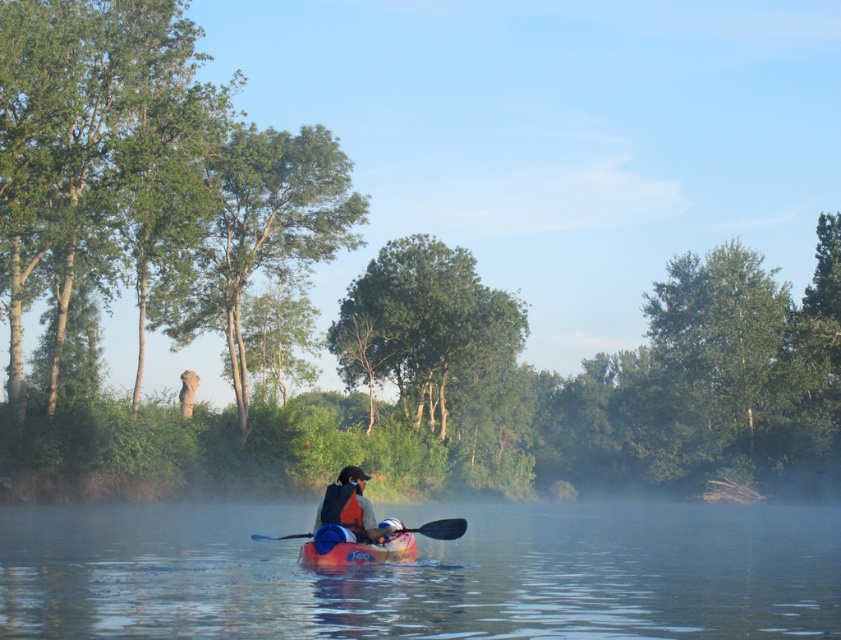
Question: Is the position of orange life vest at center more distant than that of smooth black paddle at center?

Choices:
 (A) yes
 (B) no

Answer: (B)

Question: Is green leafy tree at left to the left of smooth black paddle at center from the viewer's perspective?

Choices:
 (A) yes
 (B) no

Answer: (A)

Question: Where is green leafy tree at center located in relation to orange plastic canoe at center in the image?

Choices:
 (A) below
 (B) above

Answer: (B)

Question: Which object appears farthest from the camera in this image?

Choices:
 (A) smooth water at center
 (B) green leafy tree at upper left
 (C) green leafy tree at left
 (D) green leafy tree at center

Answer: (D)

Question: Which of the following is the closest to the observer?

Choices:
 (A) (355, 365)
 (B) (750, 621)

Answer: (B)

Question: Among these points, which one is farthest from the camera?

Choices:
 (A) (124, 72)
 (B) (309, 532)
 (C) (376, 536)

Answer: (A)